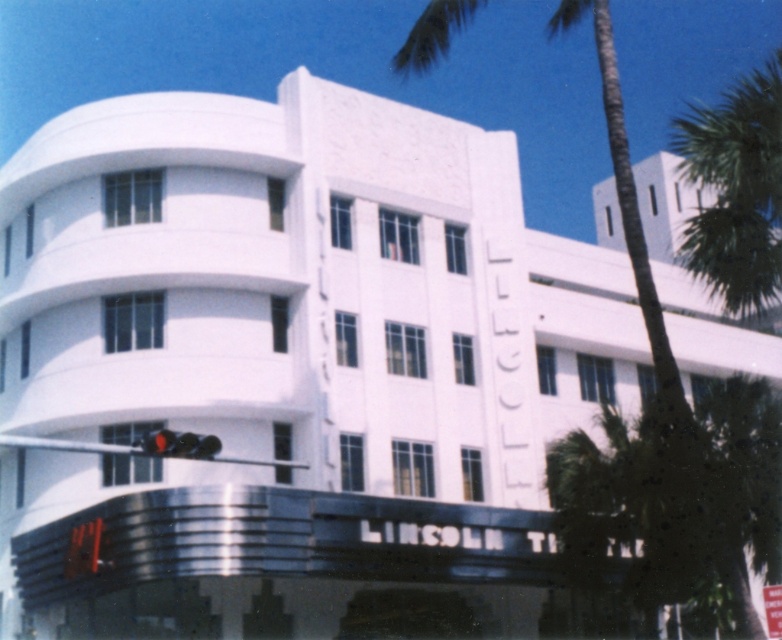
Is point (637, 220) closer to camera compared to point (151, 436)?

Yes, point (637, 220) is in front of point (151, 436).

Which is in front, point (633, 246) or point (162, 449)?

Point (162, 449) is more forward.

Does point (626, 227) lie in front of point (196, 436)?

Yes, point (626, 227) is in front of point (196, 436).

What are the coordinates of `green leafy palm tree at center` in the screenshot? It's located at (626, 198).

Does green leafy palm tree at center appear on the right side of white plastic street sign at center?

Correct, you'll find green leafy palm tree at center to the right of white plastic street sign at center.

Measure the distance from green leafy palm tree at center to white plastic street sign at center.

30.14 meters

I want to click on green leafy palm tree at center, so click(626, 198).

Where is `green leafy palm tree at center`? green leafy palm tree at center is located at coordinates (626, 198).

Describe the element at coordinates (178, 444) in the screenshot. The width and height of the screenshot is (782, 640). I see `matte black traffic light at lower center` at that location.

Can you confirm if matte black traffic light at lower center is taller than white plastic street sign at center?

Yes.

Locate an element on the screen. The image size is (782, 640). matte black traffic light at lower center is located at coordinates (178, 444).